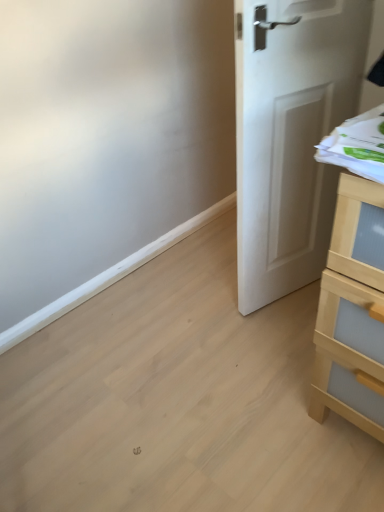
Question: Can you confirm if light wood chest of drawers at right is bigger than white matte door at center?

Choices:
 (A) no
 (B) yes

Answer: (B)

Question: Can you confirm if light wood chest of drawers at right is positioned to the left of white matte door at center?

Choices:
 (A) yes
 (B) no

Answer: (B)

Question: From the image's perspective, is light wood chest of drawers at right over white matte door at center?

Choices:
 (A) no
 (B) yes

Answer: (A)

Question: Does light wood chest of drawers at right have a greater height compared to white matte door at center?

Choices:
 (A) no
 (B) yes

Answer: (A)

Question: From a real-world perspective, is light wood chest of drawers at right on top of white matte door at center?

Choices:
 (A) no
 (B) yes

Answer: (A)

Question: From a real-world perspective, is light wood chest of drawers at right located beneath white matte door at center?

Choices:
 (A) no
 (B) yes

Answer: (B)

Question: Can we say white matte door at center lies outside light wood chest of drawers at right?

Choices:
 (A) yes
 (B) no

Answer: (A)

Question: Does white matte door at center have a lesser height compared to light wood chest of drawers at right?

Choices:
 (A) yes
 (B) no

Answer: (B)

Question: Does white matte door at center come behind light wood chest of drawers at right?

Choices:
 (A) no
 (B) yes

Answer: (B)

Question: Is there a large distance between white matte door at center and light wood chest of drawers at right?

Choices:
 (A) yes
 (B) no

Answer: (B)

Question: From the image's perspective, is white matte door at center under light wood chest of drawers at right?

Choices:
 (A) yes
 (B) no

Answer: (B)

Question: Does white matte door at center have a smaller size compared to light wood chest of drawers at right?

Choices:
 (A) no
 (B) yes

Answer: (B)

Question: From a real-world perspective, is white matte door at center physically located above or below light wood chest of drawers at right?

Choices:
 (A) above
 (B) below

Answer: (A)